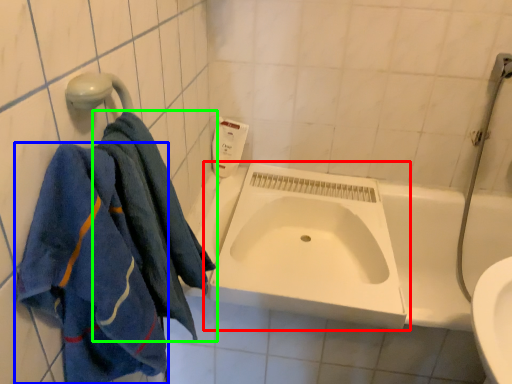
Question: Based on their relative distances, which object is nearer to sink (highlighted by a red box)? Choose from towel (highlighted by a blue box) and towel (highlighted by a green box).

Choices:
 (A) towel
 (B) towel

Answer: (B)